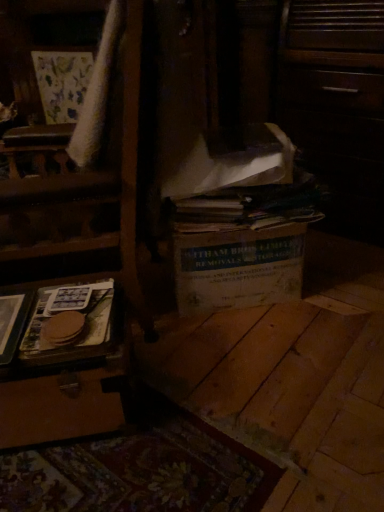
The height and width of the screenshot is (512, 384). Describe the element at coordinates (65, 378) in the screenshot. I see `wooden tray at left` at that location.

What is the approximate width of wooden tray at left?

The width of wooden tray at left is 43.06 centimeters.

The width and height of the screenshot is (384, 512). In order to click on velvet-like beige armchair at upper left in this screenshot , I will do point(55,98).

Which point is more forward, (x=65, y=100) or (x=225, y=231)?

The point (x=225, y=231) is more forward.

Looking at this image, can you tell me how much velvet-like beige armchair at upper left and white cardboard box at center differ in facing direction?

There is a 44.4-degree angle between the facing directions of velvet-like beige armchair at upper left and white cardboard box at center.

Can you confirm if velvet-like beige armchair at upper left is bigger than white cardboard box at center?

Yes, velvet-like beige armchair at upper left is bigger than white cardboard box at center.

Looking at this image, considering the relative sizes of velvet-like beige armchair at upper left and white cardboard box at center in the image provided, is velvet-like beige armchair at upper left taller than white cardboard box at center?

Yes.

From the image's perspective, is wooden tray at left beneath white cardboard box at center?

Yes, from the image's perspective, wooden tray at left is beneath white cardboard box at center.

Is white cardboard box at center at the back of wooden tray at left?

No, wooden tray at left's orientation is not away from white cardboard box at center.

Measure the distance from wooden tray at left to white cardboard box at center.

wooden tray at left is 20.23 inches from white cardboard box at center.

Considering the sizes of objects wooden tray at left and white cardboard box at center in the image provided, who is shorter, wooden tray at left or white cardboard box at center?

wooden tray at left is shorter.

Is the depth of velvet-like beige armchair at upper left greater than that of brown paper at lower left?

That is True.

Which of these two, velvet-like beige armchair at upper left or brown paper at lower left, is bigger?

velvet-like beige armchair at upper left.

Considering the sizes of velvet-like beige armchair at upper left and brown paper at lower left in the image, is velvet-like beige armchair at upper left taller or shorter than brown paper at lower left?

Clearly, velvet-like beige armchair at upper left is taller compared to brown paper at lower left.

What's the angular difference between brown paper at lower left and white cardboard box at center's facing directions?

brown paper at lower left and white cardboard box at center are facing 3.07 degrees away from each other.

Is brown paper at lower left positioned beyond the bounds of white cardboard box at center?

Yes, brown paper at lower left is not within white cardboard box at center.

At what (x,y) coordinates should I click in order to perform the action: click on cardboard box located above the brown paper at lower left (from the image's perspective). Please return your answer as a coordinate pair (x, y). Looking at the image, I should click on (238, 268).

Is brown paper at lower left facing towards white cardboard box at center?

No, brown paper at lower left does not turn towards white cardboard box at center.

Between velvet-like beige armchair at upper left and wooden tray at left, which one appears on the left side from the viewer's perspective?

Positioned to the left is velvet-like beige armchair at upper left.

Who is bigger, velvet-like beige armchair at upper left or wooden tray at left?

With larger size is velvet-like beige armchair at upper left.

In the scene shown: Is velvet-like beige armchair at upper left inside or outside of wooden tray at left?

velvet-like beige armchair at upper left cannot be found inside wooden tray at left.

Which object is further away from the camera taking this photo, velvet-like beige armchair at upper left or wooden tray at left?

velvet-like beige armchair at upper left is behind.

You are a GUI agent. You are given a task and a screenshot of the screen. Output one action in this format:
    pyautogui.click(x=<x>, y=<y>)
    Task: Click on the cardboard box that appears behind the brown paper at lower left
    The height and width of the screenshot is (512, 384).
    Given the screenshot: What is the action you would take?
    pyautogui.click(x=238, y=268)

Could you tell me if white cardboard box at center is facing brown paper at lower left?

No.

Can you confirm if white cardboard box at center is positioned to the left of brown paper at lower left?

In fact, white cardboard box at center is to the right of brown paper at lower left.

Is white cardboard box at center looking in the opposite direction of velvet-like beige armchair at upper left?

No.

Considering the sizes of objects white cardboard box at center and velvet-like beige armchair at upper left in the image provided, who is thinner, white cardboard box at center or velvet-like beige armchair at upper left?

With smaller width is velvet-like beige armchair at upper left.

Is white cardboard box at center in contact with velvet-like beige armchair at upper left?

There is a gap between white cardboard box at center and velvet-like beige armchair at upper left.

From the image's perspective, which is above, white cardboard box at center or velvet-like beige armchair at upper left?

velvet-like beige armchair at upper left, from the image's perspective.

The width and height of the screenshot is (384, 512). Identify the location of cardboard box below the velvet-like beige armchair at upper left (from a real-world perspective). [238, 268].

Identify the location of vanity lying below the white cardboard box at center (from the image's perspective). Image resolution: width=384 pixels, height=512 pixels. (65, 378).

Based on their spatial positions, is wooden tray at left or brown paper at lower left closer to velvet-like beige armchair at upper left?

Among the two, brown paper at lower left is located nearer to velvet-like beige armchair at upper left.

Which object lies further to the anchor point white cardboard box at center, wooden tray at left or brown paper at lower left?

Among the two, wooden tray at left is located further to white cardboard box at center.

Estimate the real-world distances between objects in this image. Which object is closer to velvet-like beige armchair at upper left, wooden tray at left or white cardboard box at center?

white cardboard box at center lies closer to velvet-like beige armchair at upper left than the other object.

When comparing their distances from white cardboard box at center, does wooden tray at left or velvet-like beige armchair at upper left seem further?

Among the two, velvet-like beige armchair at upper left is located further to white cardboard box at center.

Based on their spatial positions, is brown paper at lower left or velvet-like beige armchair at upper left closer to white cardboard box at center?

brown paper at lower left.

In the scene shown: When comparing their distances from velvet-like beige armchair at upper left, does brown paper at lower left or white cardboard box at center seem closer?

Based on the image, white cardboard box at center appears to be nearer to velvet-like beige armchair at upper left.

From the image, which object appears to be nearer to wooden tray at left, brown paper at lower left or velvet-like beige armchair at upper left?

Among the two, brown paper at lower left is located nearer to wooden tray at left.

From the image, which object appears to be farther from wooden tray at left, velvet-like beige armchair at upper left or white cardboard box at center?

The object further to wooden tray at left is velvet-like beige armchair at upper left.

I want to click on paperback book between wooden tray at left and velvet-like beige armchair at upper left in the front-back direction, so click(x=79, y=311).

Where is `cardboard box between velvet-like beige armchair at upper left and wooden tray at left in the up-down direction`? cardboard box between velvet-like beige armchair at upper left and wooden tray at left in the up-down direction is located at coordinates (238, 268).

The image size is (384, 512). What are the coordinates of `cardboard box positioned between brown paper at lower left and velvet-like beige armchair at upper left from near to far` in the screenshot? It's located at (238, 268).

Where is `paperback book between wooden tray at left and white cardboard box at center from left to right`? The image size is (384, 512). paperback book between wooden tray at left and white cardboard box at center from left to right is located at coordinates (79, 311).